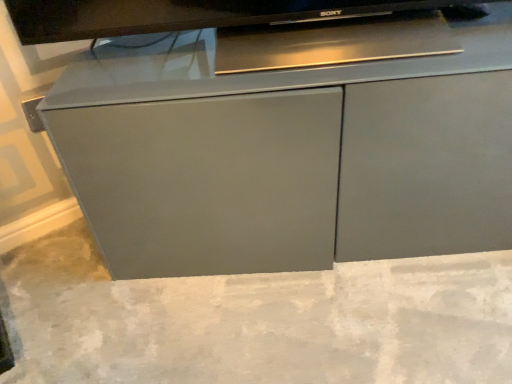
Question: Considering the positions of gray concrete at center and matte gray cabinet at center in the image, is gray concrete at center bigger or smaller than matte gray cabinet at center?

Choices:
 (A) small
 (B) big

Answer: (A)

Question: Is gray concrete at center taller or shorter than matte gray cabinet at center?

Choices:
 (A) tall
 (B) short

Answer: (B)

Question: Considering the relative positions of gray concrete at center and matte gray cabinet at center in the image provided, is gray concrete at center to the left or to the right of matte gray cabinet at center?

Choices:
 (A) right
 (B) left

Answer: (B)

Question: Is point pos(412,94) positioned closer to the camera than point pos(89,281)?

Choices:
 (A) closer
 (B) farther

Answer: (A)

Question: Considering the positions of matte gray cabinet at center and gray concrete at center in the image, is matte gray cabinet at center bigger or smaller than gray concrete at center?

Choices:
 (A) small
 (B) big

Answer: (B)

Question: Considering the positions of matte gray cabinet at center and gray concrete at center in the image, is matte gray cabinet at center wider or thinner than gray concrete at center?

Choices:
 (A) wide
 (B) thin

Answer: (B)

Question: Considering the positions of matte gray cabinet at center and gray concrete at center in the image, is matte gray cabinet at center taller or shorter than gray concrete at center?

Choices:
 (A) tall
 (B) short

Answer: (A)